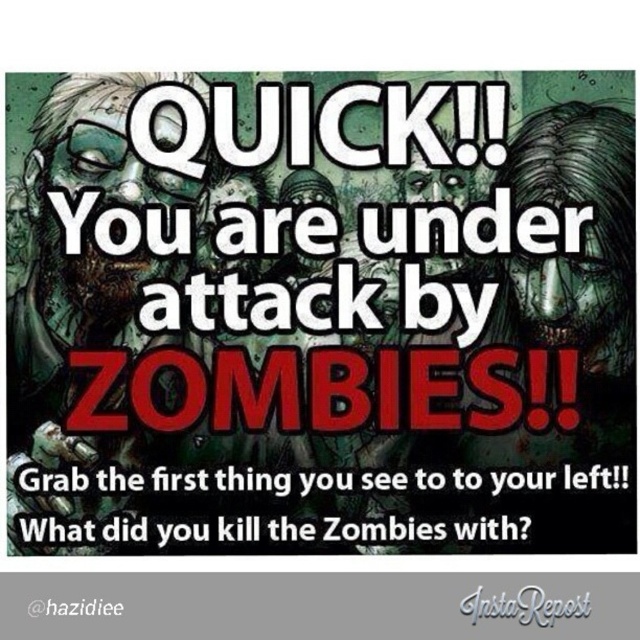
Does graytexturedinstarepost at center appear over red text at lower left?

Yes, graytexturedinstarepost at center is above red text at lower left.

Is the position of graytexturedinstarepost at center less distant than that of red text at lower left?

That is True.

Which is behind, point (509, 602) or point (56, 600)?

The point (56, 600) is more distant.

Find the location of `graytexturedinstarepost at center`. graytexturedinstarepost at center is located at coordinates (524, 605).

Does white paper at center appear on the right side of red text at lower left?

Indeed, white paper at center is positioned on the right side of red text at lower left.

How distant is white paper at center from red text at lower left?

The distance of white paper at center from red text at lower left is 9.19 feet.

Is point (417, 499) positioned before point (48, 605)?

Yes, it is in front of point (48, 605).

Where is `white paper at center`? Image resolution: width=640 pixels, height=640 pixels. white paper at center is located at coordinates (316, 508).

This screenshot has width=640, height=640. In order to click on white paper at center in this screenshot , I will do `click(316, 508)`.

Does point (413, 509) come behind point (534, 612)?

Yes.

Identify the location of white paper at center. The width and height of the screenshot is (640, 640). (316, 508).